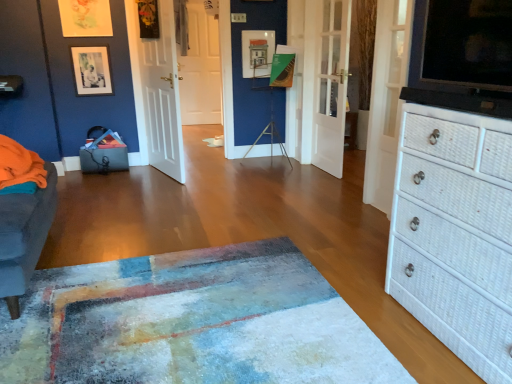
The width and height of the screenshot is (512, 384). Describe the element at coordinates (200, 69) in the screenshot. I see `white matte door at center, placed as the second door when sorted from left to right` at that location.

The width and height of the screenshot is (512, 384). Describe the element at coordinates (91, 70) in the screenshot. I see `matte black picture frame at upper left` at that location.

The height and width of the screenshot is (384, 512). Find the location of `white matte door at center, which ranks as the 3th door in right-to-left order`. white matte door at center, which ranks as the 3th door in right-to-left order is located at coordinates pyautogui.click(x=200, y=69).

Considering the relative sizes of white textured door at upper right, which is the fourth door in back-to-front order, and white wooden door at left, which appears as the third door when viewed from the back, in the image provided, is white textured door at upper right, which is the fourth door in back-to-front order, smaller than white wooden door at left, which appears as the third door when viewed from the back,?

Yes, white textured door at upper right, which is the fourth door in back-to-front order, is smaller than white wooden door at left, which appears as the third door when viewed from the back.

How many degrees apart are the facing directions of white textured door at upper right, the first door when ordered from front to back, and white wooden door at left, placed as the fourth door when sorted from right to left?

11.5 degrees.

Is white textured door at upper right, the 4th door when ordered from left to right, facing towards white wooden door at left, arranged as the 2th door when viewed from the front?

No.

Can you see white glossy door at center, the 2th door positioned from the right, touching matte black picture frame at upper left?

white glossy door at center, the 2th door positioned from the right, is not next to matte black picture frame at upper left, and they're not touching.

From a real-world perspective, who is located lower, white glossy door at center, the 2th door positioned from the right, or matte black picture frame at upper left?

white glossy door at center, the 2th door positioned from the right.

How many degrees apart are the facing directions of white glossy door at center, the 2th door positioned from the right, and matte black picture frame at upper left?

The angular difference between white glossy door at center, the 2th door positioned from the right, and matte black picture frame at upper left is 90.2 degrees.

Looking at this image, is matte black picture frame at upper left positioned in front of white textured door at upper right, which ranks as the 1th door in right-to-left order?

No, matte black picture frame at upper left is behind white textured door at upper right, which ranks as the 1th door in right-to-left order.

From a real-world perspective, which object stands above the other?

white textured door at upper right, which is the fourth door in back-to-front order, is physically above.

Is matte black picture frame at upper left to the left of white textured door at upper right, which is the fourth door in back-to-front order, from the viewer's perspective?

Yes.

Choose the correct answer: Is white textured door at upper right, which is the fourth door in back-to-front order, inside white wicker chest of drawers at right or outside it?

white textured door at upper right, which is the fourth door in back-to-front order, is outside white wicker chest of drawers at right.

Can you confirm if white textured door at upper right, the 4th door when ordered from left to right, is shorter than white wicker chest of drawers at right?

Yes.

Considering the relative sizes of white textured door at upper right, which is the fourth door in back-to-front order, and white wicker chest of drawers at right in the image provided, is white textured door at upper right, which is the fourth door in back-to-front order, thinner than white wicker chest of drawers at right?

Correct, the width of white textured door at upper right, which is the fourth door in back-to-front order, is less than that of white wicker chest of drawers at right.

Does point (384, 21) appear closer or farther from the camera than point (506, 283)?

Point (384, 21) is positioned farther from the camera compared to point (506, 283).

Is point (159, 84) closer to viewer compared to point (217, 87)?

Yes, it is in front of point (217, 87).

Is white wooden door at left, which ranks as the first door in left-to-right order, situated inside white matte door at center, placed as the first door when sorted from back to front, or outside?

white wooden door at left, which ranks as the first door in left-to-right order, exists outside the volume of white matte door at center, placed as the first door when sorted from back to front.

I want to click on the 1st door located above the white wooden door at left, which appears as the third door when viewed from the back (from a real-world perspective), so [x=200, y=69].

From a real-world perspective, is white wooden door at left, which appears as the third door when viewed from the back, above or below white matte door at center, placed as the first door when sorted from back to front?

white wooden door at left, which appears as the third door when viewed from the back, is situated lower than white matte door at center, placed as the first door when sorted from back to front, in the real world.

Looking at this image, between white wicker chest of drawers at right and matte black picture frame at upper left, which one is positioned in front?

Positioned in front is white wicker chest of drawers at right.

Where is `picture frame on the left of white wicker chest of drawers at right`? The width and height of the screenshot is (512, 384). picture frame on the left of white wicker chest of drawers at right is located at coordinates (91, 70).

Is white wicker chest of drawers at right aimed at matte black picture frame at upper left?

No, white wicker chest of drawers at right is not aimed at matte black picture frame at upper left.

How much distance is there between white wicker chest of drawers at right and matte black picture frame at upper left?

white wicker chest of drawers at right and matte black picture frame at upper left are 3.24 meters apart from each other.

From the image's perspective, is matte black picture frame at upper left on white wicker chest of drawers at right?

Yes, from the image's perspective, matte black picture frame at upper left is above white wicker chest of drawers at right.

Can you see matte black picture frame at upper left touching white wicker chest of drawers at right?

No, matte black picture frame at upper left is not touching white wicker chest of drawers at right.

Can you tell me how much matte black picture frame at upper left and white wicker chest of drawers at right differ in facing direction?

91.6 degrees.

Looking at this image, is white wicker chest of drawers at right a part of matte black picture frame at upper left?

Definitely not — white wicker chest of drawers at right is not inside matte black picture frame at upper left.

This screenshot has width=512, height=384. I want to click on door that is the 2nd one above the white wooden door at left, which appears as the third door when viewed from the back (from a real-world perspective), so click(x=386, y=100).

Locate an element on the screen. picture frame above the white glossy door at center, placed as the third door when sorted from front to back (from the image's perspective) is located at coordinates (91, 70).

Consider the image. From the image, which object appears to be nearer to white wicker chest of drawers at right, textured blue rug at center or white textured door at upper right, the 4th door when ordered from left to right?

textured blue rug at center is closer to white wicker chest of drawers at right.

Estimate the real-world distances between objects in this image. Which object is closer to white matte door at center, which ranks as the 3th door in right-to-left order, white glossy door at center, placed as the third door when sorted from front to back, or white wicker chest of drawers at right?

white glossy door at center, placed as the third door when sorted from front to back, lies closer to white matte door at center, which ranks as the 3th door in right-to-left order, than the other object.

When comparing their distances from white glossy door at center, the 2th door in the back-to-front sequence, does white wooden door at left, arranged as the 2th door when viewed from the front, or white matte door at center, placed as the second door when sorted from left to right, seem further?

white matte door at center, placed as the second door when sorted from left to right, lies further to white glossy door at center, the 2th door in the back-to-front sequence, than the other object.

Consider the image. Which object lies nearer to the anchor point white wicker chest of drawers at right, white wooden door at left, arranged as the 2th door when viewed from the front, or textured blue rug at center?

textured blue rug at center is closer to white wicker chest of drawers at right.

Considering their positions, is white glossy door at center, the 2th door in the back-to-front sequence, positioned closer to white textured door at upper right, which is the fourth door in back-to-front order, than textured blue rug at center?

The object closer to white textured door at upper right, which is the fourth door in back-to-front order, is white glossy door at center, the 2th door in the back-to-front sequence.

From the image, which object appears to be farther from white glossy door at center, which is the 3th door from left to right, white textured door at upper right, which ranks as the 1th door in right-to-left order, or white matte door at center, placed as the second door when sorted from left to right?

white matte door at center, placed as the second door when sorted from left to right, is positioned further to the anchor white glossy door at center, which is the 3th door from left to right.

Considering their positions, is matte black picture frame at upper left positioned closer to white glossy door at center, the 2th door in the back-to-front sequence, than white wicker chest of drawers at right?

The object closer to white glossy door at center, the 2th door in the back-to-front sequence, is matte black picture frame at upper left.

From the image, which object appears to be farther from white wooden door at left, placed as the fourth door when sorted from right to left, white wicker chest of drawers at right or white matte door at center, the fourth door when ordered from front to back?

white wicker chest of drawers at right lies further to white wooden door at left, placed as the fourth door when sorted from right to left, than the other object.

You are a GUI agent. You are given a task and a screenshot of the screen. Output one action in this format:
    pyautogui.click(x=<x>, y=<y>)
    Task: Click on the picture frame between white glossy door at center, placed as the third door when sorted from front to back, and white matte door at center, which ranks as the 3th door in right-to-left order, in the front-back direction
    
    Given the screenshot: What is the action you would take?
    pyautogui.click(x=91, y=70)

At what (x,y) coordinates should I click in order to perform the action: click on picture frame between white textured door at upper right, the first door when ordered from front to back, and white matte door at center, placed as the second door when sorted from left to right, from front to back. Please return your answer as a coordinate pair (x, y). This screenshot has width=512, height=384. Looking at the image, I should click on (91, 70).

Locate an element on the screen. The image size is (512, 384). chest of drawers between textured blue rug at center and matte black picture frame at upper left in the front-back direction is located at coordinates (455, 234).

At what (x,y) coordinates should I click in order to perform the action: click on the chest of drawers positioned between textured blue rug at center and white wooden door at left, which appears as the third door when viewed from the back, from near to far. Please return your answer as a coordinate pair (x, y). Looking at the image, I should click on (455, 234).